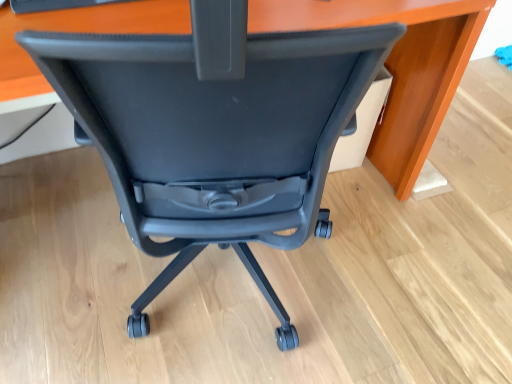
This screenshot has height=384, width=512. I want to click on unoccupied region to the right of matte black chair at center, so click(x=442, y=225).